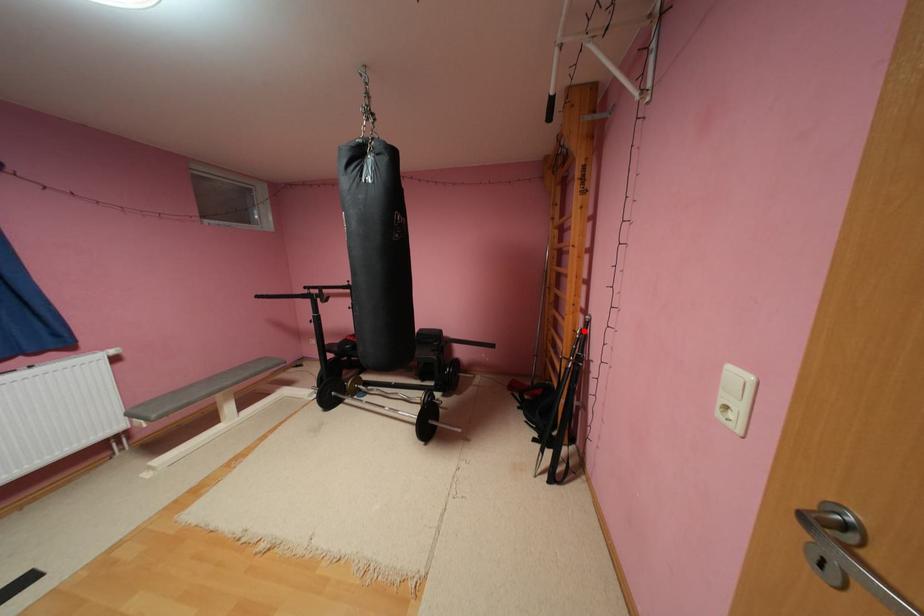
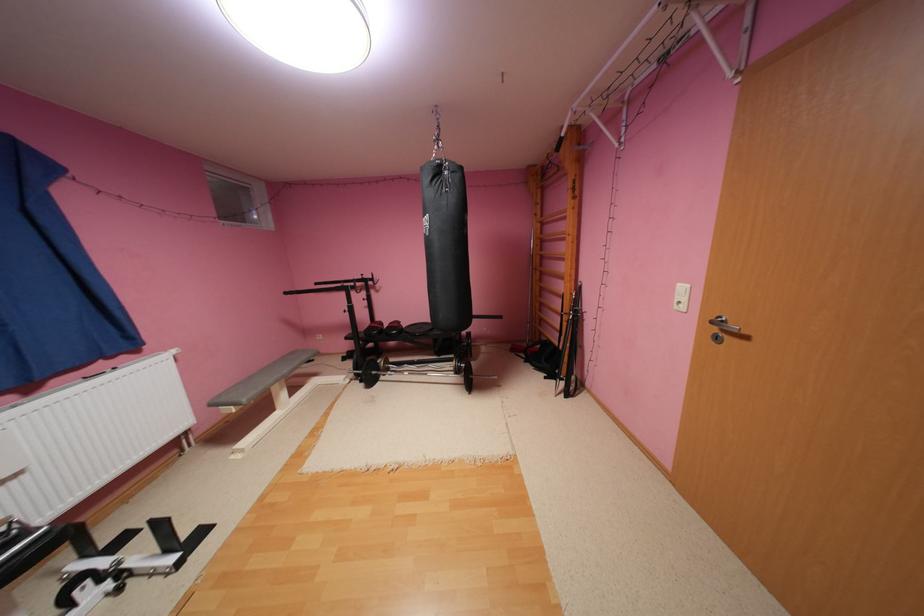
Where in the second image is the point corresponding to the highlighted location from the first image?

(580, 294)